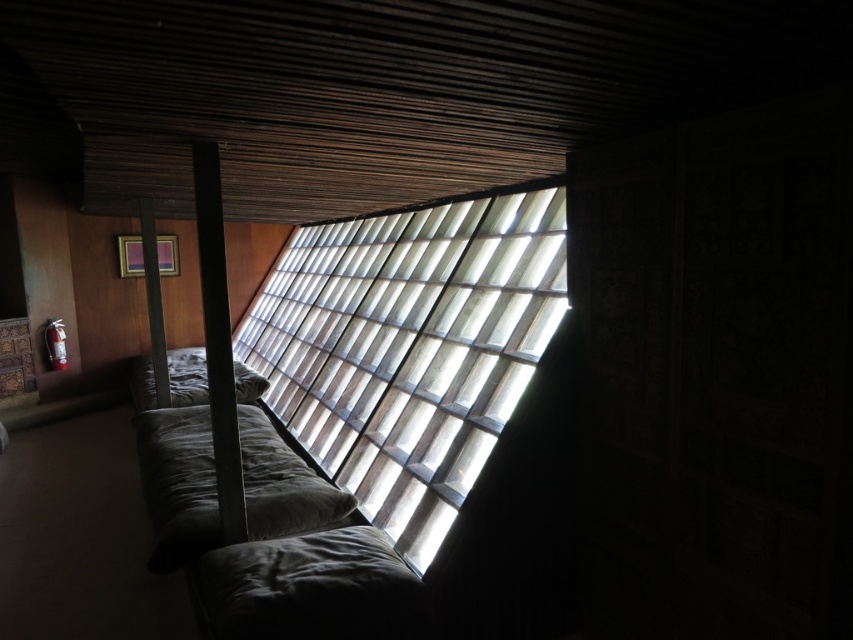
Question: Does black matte beam at center appear on the right side of matte gray beam at center?

Choices:
 (A) no
 (B) yes

Answer: (B)

Question: Can you confirm if translucent wood window at center is positioned below matte gray beam at center?

Choices:
 (A) yes
 (B) no

Answer: (A)

Question: Which point appears farthest from the camera in this image?

Choices:
 (A) (149, 296)
 (B) (198, 225)
 (C) (219, 588)

Answer: (A)

Question: Which point is farther to the camera?

Choices:
 (A) black matte beam at center
 (B) dark gray fabric pillow at center
 (C) velvet green bed at center
 (D) matte gray beam at center

Answer: (B)

Question: Considering the relative positions of velvet green bed at center and matte gray beam at center in the image provided, where is velvet green bed at center located with respect to matte gray beam at center?

Choices:
 (A) right
 (B) left

Answer: (A)

Question: Among these objects, which one is farthest from the camera?

Choices:
 (A) translucent wood window at center
 (B) matte gray beam at center
 (C) black matte beam at center

Answer: (B)